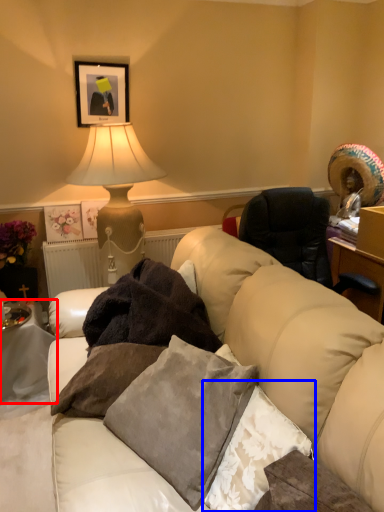
Question: Which object appears closest to the camera in this image, table (highlighted by a red box) or pillow (highlighted by a blue box)?

Choices:
 (A) table
 (B) pillow

Answer: (B)